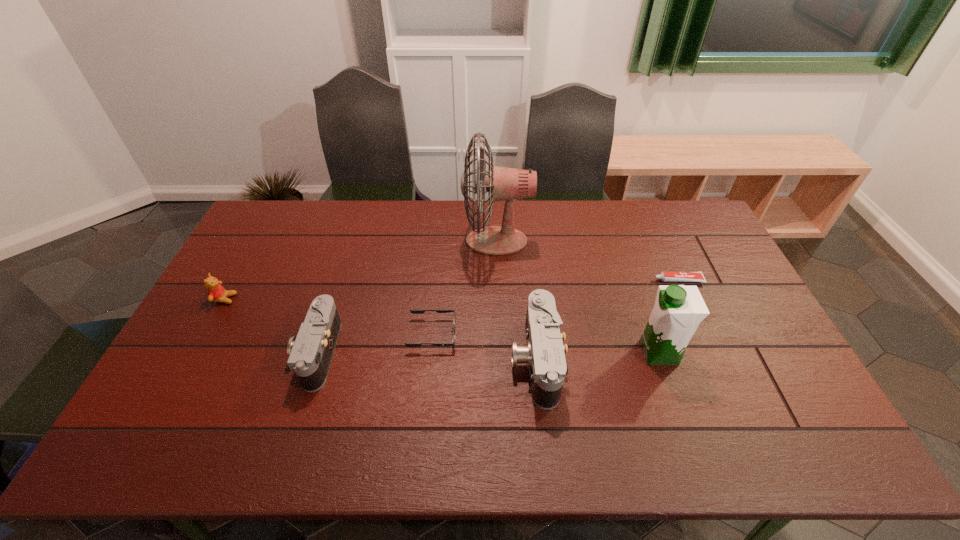
Considering the uniform spacing of cameras, where should an additional camera be positioned on the right? Please locate a free spot. Please provide its 2D coordinates. Your answer should be formatted as a tuple, i.e. [(x, y)], where the tuple contains the x and y coordinates of a point satisfying the conditions above.

[(758, 367)]